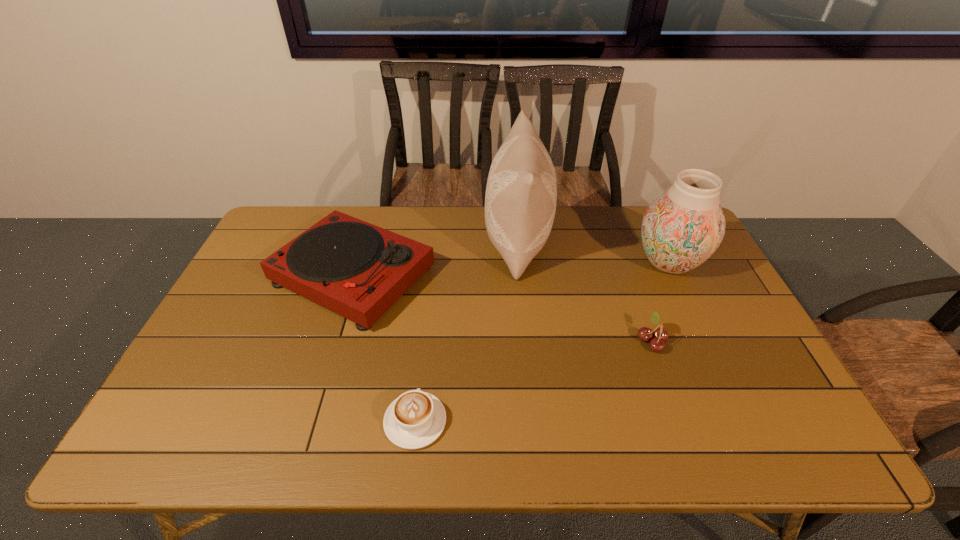
I want to click on cushion, so click(x=521, y=194).

You are a GUI agent. You are given a task and a screenshot of the screen. Output one action in this format:
    pyautogui.click(x=<x>, y=<y>)
    Task: Click on the tallest object
    Image resolution: width=960 pixels, height=540 pixels.
    Given the screenshot: What is the action you would take?
    pyautogui.click(x=521, y=194)

Find the location of `the fourth shortest object`. the fourth shortest object is located at coordinates (683, 227).

Find the location of a particular element. This screenshot has width=960, height=540. record player is located at coordinates (358, 270).

The width and height of the screenshot is (960, 540). Identify the location of the fourth tallest object. (657, 344).

What are the coordinates of `cappuccino` in the screenshot? It's located at (414, 420).

You are a GUI agent. You are given a task and a screenshot of the screen. Output one action in this format:
    pyautogui.click(x=<x>, y=<y>)
    Task: Click on the shortest object
    
    Given the screenshot: What is the action you would take?
    pyautogui.click(x=414, y=420)

Identify the location of vacant space positioned on the front side of the cushion. Image resolution: width=960 pixels, height=540 pixels. (461, 241).

Find the location of a particular element. The width and height of the screenshot is (960, 540). vacant space located 0.050m on the front side of the cushion is located at coordinates (469, 241).

You are a GUI agent. You are given a task and a screenshot of the screen. Output one action in this format:
    pyautogui.click(x=<x>, y=<y>)
    Task: Click on the vacant space positioned 0.280m on the front side of the cushion
    
    Given the screenshot: What is the action you would take?
    pyautogui.click(x=401, y=241)